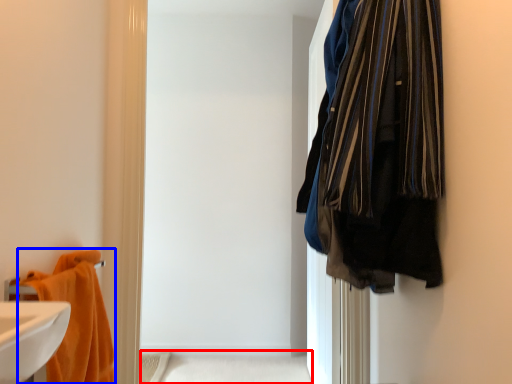
Question: Which object is further to the camera taking this photo, bath (highlighted by a red box) or towel (highlighted by a blue box)?

Choices:
 (A) bath
 (B) towel

Answer: (A)